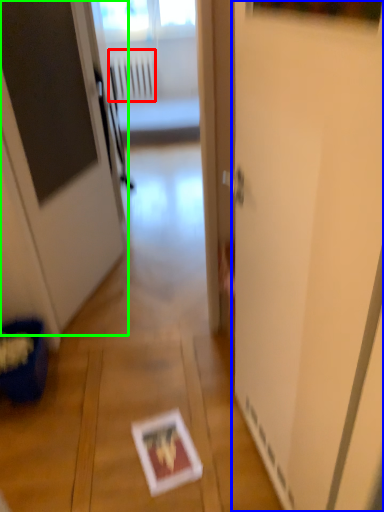
Question: Which object is the farthest from radiator (highlighted by a red box)? Choose among these: screen door (highlighted by a blue box) or door (highlighted by a green box).

Choices:
 (A) screen door
 (B) door

Answer: (A)